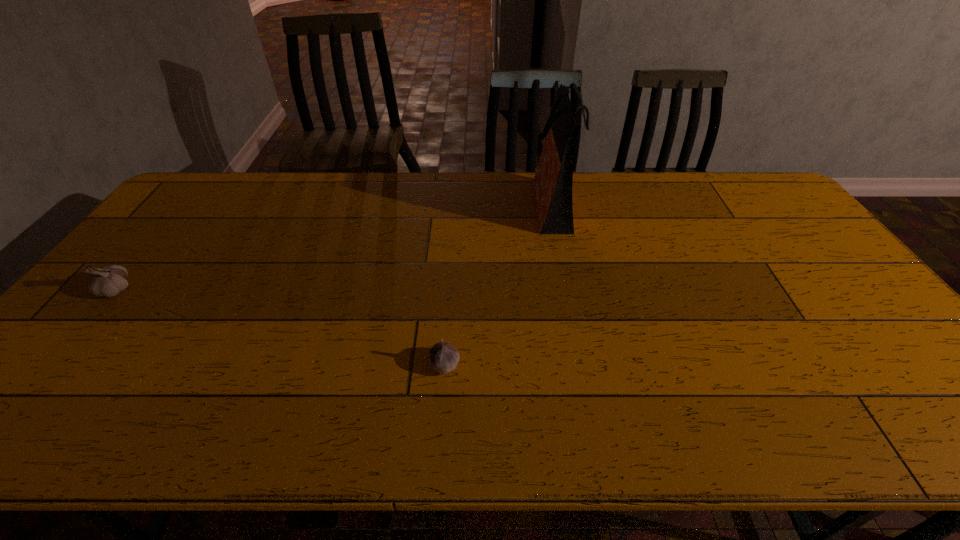
The image size is (960, 540). I want to click on vacant area situated on the left of the second object from right to left, so click(407, 364).

I want to click on object present at the far edge, so click(x=552, y=185).

Image resolution: width=960 pixels, height=540 pixels. Identify the location of object present at the left edge. (108, 281).

Where is `vacant space at the far edge of the desktop`? Image resolution: width=960 pixels, height=540 pixels. vacant space at the far edge of the desktop is located at coordinates (246, 209).

Where is `vacant region at the near edge of the desktop`? vacant region at the near edge of the desktop is located at coordinates (541, 439).

What are the coordinates of `free space at the left edge of the desktop` in the screenshot? It's located at (65, 353).

The height and width of the screenshot is (540, 960). I want to click on vacant area at the right edge of the desktop, so click(815, 278).

The width and height of the screenshot is (960, 540). What are the coordinates of `vacant space at the far right corner` in the screenshot? It's located at (759, 195).

Locate an element on the screen. This screenshot has width=960, height=540. free space between the tallest object and the farther garlic is located at coordinates (335, 247).

Where is `empty space between the tallest object and the second shortest object`? The image size is (960, 540). empty space between the tallest object and the second shortest object is located at coordinates (335, 247).